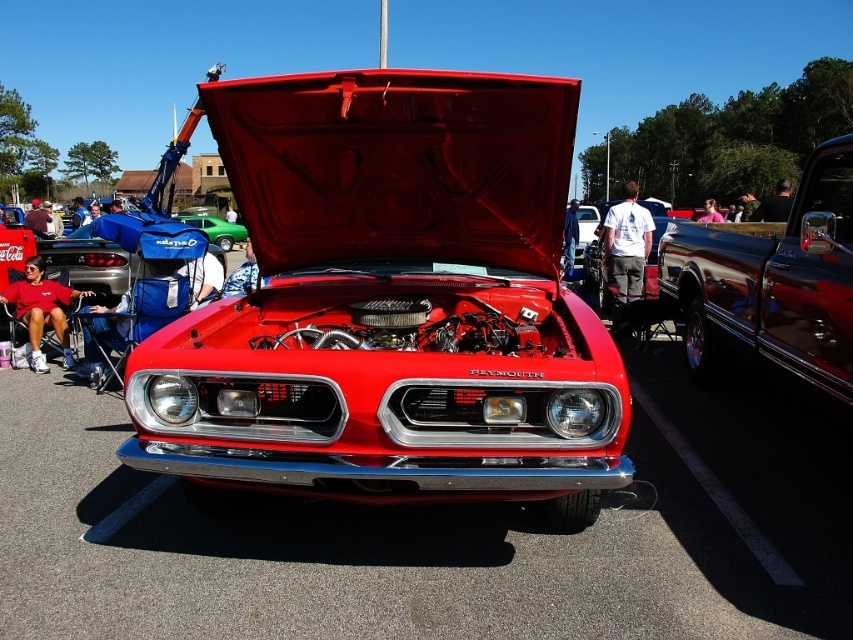
Question: Does glossy dark brown truck at right appear over green matte car at center?

Choices:
 (A) yes
 (B) no

Answer: (B)

Question: Is glossy dark brown truck at right to the right of green matte car at center from the viewer's perspective?

Choices:
 (A) yes
 (B) no

Answer: (A)

Question: Is shiny red car at center smaller than green matte car at center?

Choices:
 (A) no
 (B) yes

Answer: (B)

Question: Which point is closer to the camera?

Choices:
 (A) (822, 396)
 (B) (306, 435)
 (C) (193, 214)

Answer: (B)

Question: Which object is the farthest from the glossy dark brown truck at right?

Choices:
 (A) shiny red car at center
 (B) green matte car at center

Answer: (B)

Question: Which is nearer to the shiny red car at center?

Choices:
 (A) green matte car at center
 (B) glossy dark brown truck at right

Answer: (B)